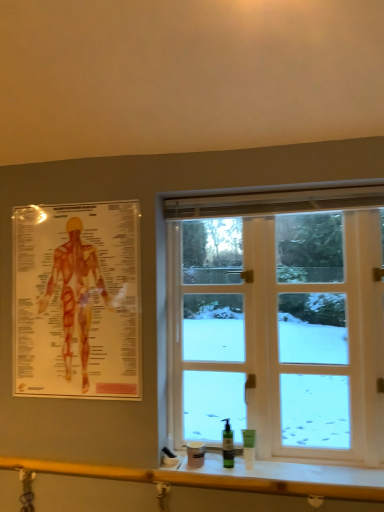
Image resolution: width=384 pixels, height=512 pixels. Describe the element at coordinates (279, 322) in the screenshot. I see `white glass window at center` at that location.

Describe the element at coordinates (228, 446) in the screenshot. The width and height of the screenshot is (384, 512). I see `green matte pump bottle at lower center, arranged as the first toiletry when viewed from the left` at that location.

Image resolution: width=384 pixels, height=512 pixels. I want to click on green plastic bottle at lower right, which is counted as the 2th toiletry, starting from the left, so click(x=249, y=447).

In order to click on white glass window at center in this screenshot , I will do 279,322.

Between green plastic bottle at lower right, which appears as the 1th toiletry when viewed from the right, and wooden at lower center, which one has smaller size?

Smaller between the two is green plastic bottle at lower right, which appears as the 1th toiletry when viewed from the right.

Which object is more forward, green plastic bottle at lower right, which is counted as the 2th toiletry, starting from the left, or wooden at lower center?

wooden at lower center is in front.

From the image's perspective, who appears lower, green plastic bottle at lower right, which is counted as the 2th toiletry, starting from the left, or wooden at lower center?

wooden at lower center, from the image's perspective.

Locate an element on the screen. This screenshot has width=384, height=512. the 1st toiletry located above the wooden at lower center (from a real-world perspective) is located at coordinates (249, 447).

From the image's perspective, is wooden at lower center located above or below green matte pump bottle at lower center, arranged as the first toiletry when viewed from the left?

Clearly, from the image's perspective, wooden at lower center is below green matte pump bottle at lower center, arranged as the first toiletry when viewed from the left.

Which object is closer to the camera, wooden at lower center or green matte pump bottle at lower center, arranged as the first toiletry when viewed from the left?

wooden at lower center is more forward.

I want to click on toiletry that is the 2nd one above the wooden at lower center (from a real-world perspective), so click(x=228, y=446).

Can you confirm if wooden at lower center is positioned to the left of green matte pump bottle at lower center, arranged as the first toiletry when viewed from the left?

Yes.

Is transparent plastic poster at upper left taller than green plastic bottle at lower right, which appears as the 1th toiletry when viewed from the right?

Correct, transparent plastic poster at upper left is much taller as green plastic bottle at lower right, which appears as the 1th toiletry when viewed from the right.

What's the angular difference between transparent plastic poster at upper left and green plastic bottle at lower right, which appears as the 1th toiletry when viewed from the right,'s facing directions?

There is a 0.785-degree angle between the facing directions of transparent plastic poster at upper left and green plastic bottle at lower right, which appears as the 1th toiletry when viewed from the right.

Looking at this image, which is more to the left, transparent plastic poster at upper left or green plastic bottle at lower right, which appears as the 1th toiletry when viewed from the right?

Positioned to the left is transparent plastic poster at upper left.

Measure the distance between transparent plastic poster at upper left and green plastic bottle at lower right, which is counted as the 2th toiletry, starting from the left.

transparent plastic poster at upper left is 91.26 centimeters from green plastic bottle at lower right, which is counted as the 2th toiletry, starting from the left.

In the scene shown: Is green plastic bottle at lower right, which is counted as the 2th toiletry, starting from the left, positioned before white glass window at center?

No, green plastic bottle at lower right, which is counted as the 2th toiletry, starting from the left, is further to the viewer.

Is green plastic bottle at lower right, which appears as the 1th toiletry when viewed from the right, spatially inside white glass window at center, or outside of it?

green plastic bottle at lower right, which appears as the 1th toiletry when viewed from the right, lies outside white glass window at center.

From the image's perspective, between green plastic bottle at lower right, which appears as the 1th toiletry when viewed from the right, and white glass window at center, who is located below?

green plastic bottle at lower right, which appears as the 1th toiletry when viewed from the right.

Between green plastic bottle at lower right, which appears as the 1th toiletry when viewed from the right, and white glass window at center, which one has larger width?

white glass window at center.

Is white glass window at center turned away from green matte pump bottle at lower center, arranged as the first toiletry when viewed from the left?

Yes, green matte pump bottle at lower center, arranged as the first toiletry when viewed from the left, is at the back of white glass window at center.

Is the surface of white glass window at center in direct contact with green matte pump bottle at lower center, arranged as the first toiletry when viewed from the left?

No, white glass window at center is not next to green matte pump bottle at lower center, arranged as the first toiletry when viewed from the left.

Which of these two, white glass window at center or green matte pump bottle at lower center, the 2th toiletry when ordered from right to left, stands taller?

white glass window at center is taller.

From a real-world perspective, who is located lower, white glass window at center or green matte pump bottle at lower center, arranged as the first toiletry when viewed from the left?

In real-world perspective, green matte pump bottle at lower center, arranged as the first toiletry when viewed from the left, is lower.

Between transparent plastic poster at upper left and wooden at lower center, which one has less height?

wooden at lower center is shorter.

Does transparent plastic poster at upper left contain wooden at lower center?

No, wooden at lower center is located outside of transparent plastic poster at upper left.

Is there a large distance between transparent plastic poster at upper left and wooden at lower center?

They are positioned close to each other.

From the picture: In the image, is green matte pump bottle at lower center, the 2th toiletry when ordered from right to left, positioned in front of or behind green plastic bottle at lower right, which is counted as the 2th toiletry, starting from the left?

Visually, green matte pump bottle at lower center, the 2th toiletry when ordered from right to left, is located behind green plastic bottle at lower right, which is counted as the 2th toiletry, starting from the left.

Is green plastic bottle at lower right, which is counted as the 2th toiletry, starting from the left, surrounded by green matte pump bottle at lower center, arranged as the first toiletry when viewed from the left?

No.

Is green plastic bottle at lower right, which is counted as the 2th toiletry, starting from the left, at the back of green matte pump bottle at lower center, arranged as the first toiletry when viewed from the left?

No.

Where is `toiletry above the green plastic bottle at lower right, which appears as the 1th toiletry when viewed from the right (from the image's perspective)`? This screenshot has width=384, height=512. toiletry above the green plastic bottle at lower right, which appears as the 1th toiletry when viewed from the right (from the image's perspective) is located at coordinates (228, 446).

Identify the location of toiletry that is the 1st one above the wooden at lower center (from a real-world perspective). The height and width of the screenshot is (512, 384). (249, 447).

Identify the location of rail below the green matte pump bottle at lower center, arranged as the first toiletry when viewed from the left (from a real-world perspective). The width and height of the screenshot is (384, 512). (231, 477).

Looking at the image, which one is located closer to white glass window at center, green matte pump bottle at lower center, the 2th toiletry when ordered from right to left, or transparent plastic poster at upper left?

green matte pump bottle at lower center, the 2th toiletry when ordered from right to left, is closer to white glass window at center.

Which object lies further to the anchor point green matte pump bottle at lower center, the 2th toiletry when ordered from right to left, green plastic bottle at lower right, which is counted as the 2th toiletry, starting from the left, or wooden at lower center?

Among the two, wooden at lower center is located further to green matte pump bottle at lower center, the 2th toiletry when ordered from right to left.

In the scene shown: Estimate the real-world distances between objects in this image. Which object is closer to green plastic bottle at lower right, which appears as the 1th toiletry when viewed from the right, transparent plastic poster at upper left or white glass window at center?

Based on the image, white glass window at center appears to be nearer to green plastic bottle at lower right, which appears as the 1th toiletry when viewed from the right.

Considering their positions, is green matte pump bottle at lower center, the 2th toiletry when ordered from right to left, positioned closer to green plastic bottle at lower right, which appears as the 1th toiletry when viewed from the right, than transparent plastic poster at upper left?

green matte pump bottle at lower center, the 2th toiletry when ordered from right to left, lies closer to green plastic bottle at lower right, which appears as the 1th toiletry when viewed from the right, than the other object.

Looking at the image, which one is located further to white glass window at center, green matte pump bottle at lower center, arranged as the first toiletry when viewed from the left, or wooden at lower center?

Among the two, green matte pump bottle at lower center, arranged as the first toiletry when viewed from the left, is located further to white glass window at center.

Based on their spatial positions, is white glass window at center or wooden at lower center closer to green matte pump bottle at lower center, the 2th toiletry when ordered from right to left?

wooden at lower center lies closer to green matte pump bottle at lower center, the 2th toiletry when ordered from right to left, than the other object.

Which object lies nearer to the anchor point green matte pump bottle at lower center, the 2th toiletry when ordered from right to left, wooden at lower center or green plastic bottle at lower right, which appears as the 1th toiletry when viewed from the right?

green plastic bottle at lower right, which appears as the 1th toiletry when viewed from the right, is positioned closer to the anchor green matte pump bottle at lower center, the 2th toiletry when ordered from right to left.

Based on their spatial positions, is transparent plastic poster at upper left or wooden at lower center further from green matte pump bottle at lower center, arranged as the first toiletry when viewed from the left?

The object further to green matte pump bottle at lower center, arranged as the first toiletry when viewed from the left, is transparent plastic poster at upper left.

Where is `rail situated between transparent plastic poster at upper left and white glass window at center from left to right`? The height and width of the screenshot is (512, 384). rail situated between transparent plastic poster at upper left and white glass window at center from left to right is located at coordinates (231, 477).

The image size is (384, 512). I want to click on toiletry between transparent plastic poster at upper left and green plastic bottle at lower right, which appears as the 1th toiletry when viewed from the right, in the horizontal direction, so click(x=228, y=446).

Where is `toiletry between white glass window at center and green plastic bottle at lower right, which is counted as the 2th toiletry, starting from the left, in the vertical direction`? toiletry between white glass window at center and green plastic bottle at lower right, which is counted as the 2th toiletry, starting from the left, in the vertical direction is located at coordinates (228, 446).

Where is `toiletry between wooden at lower center and green plastic bottle at lower right, which appears as the 1th toiletry when viewed from the right, from left to right`? The height and width of the screenshot is (512, 384). toiletry between wooden at lower center and green plastic bottle at lower right, which appears as the 1th toiletry when viewed from the right, from left to right is located at coordinates (228, 446).